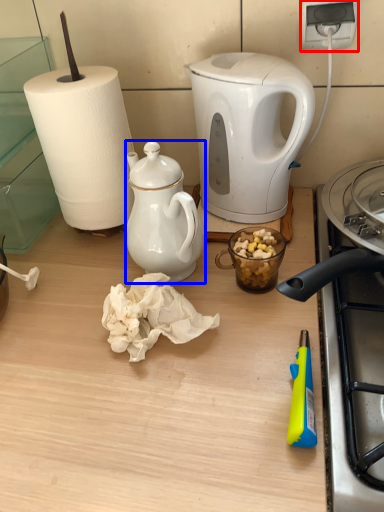
Question: Which of the following is the farthest to the observer, power outlet (highlighted by a red box) or teapot (highlighted by a blue box)?

Choices:
 (A) power outlet
 (B) teapot

Answer: (A)